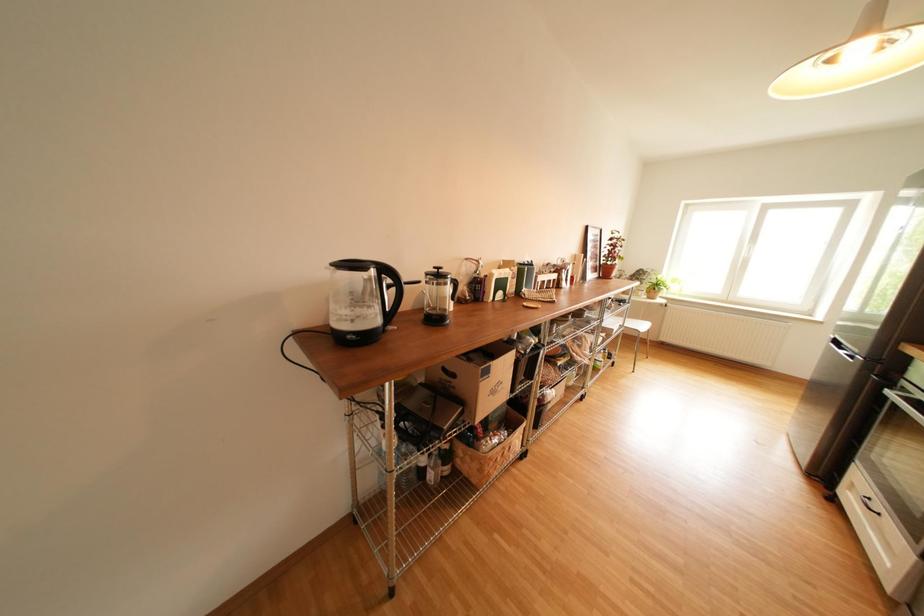
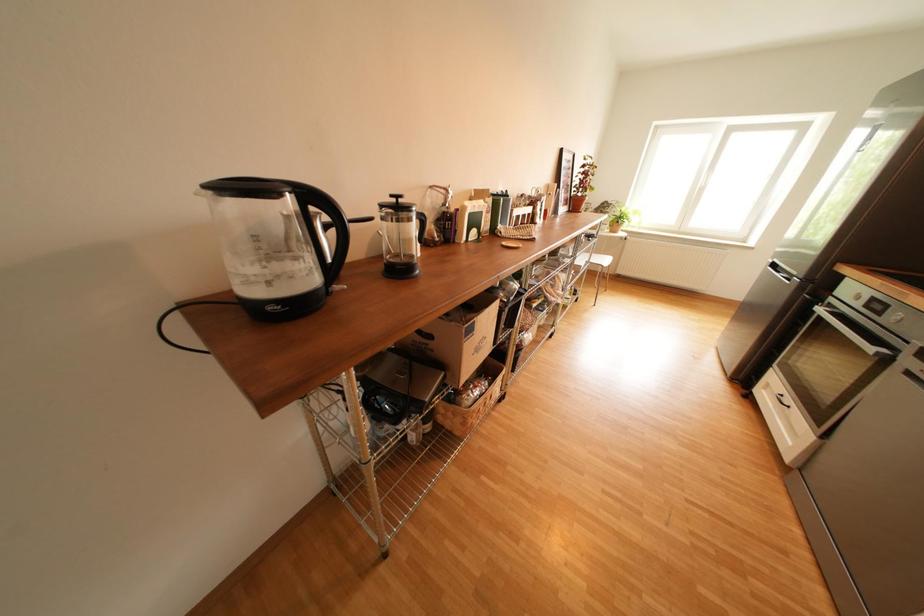
Question: The images are taken continuously from a first-person perspective. In which direction is your viewpoint rotating?

Choices:
 (A) Left
 (B) Right
 (C) Up
 (D) Down

Answer: (D)